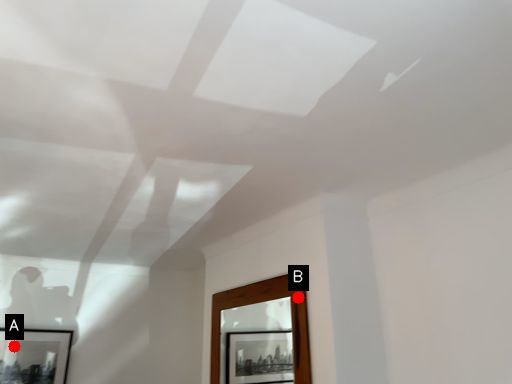
Question: Two points are circled on the image, labeled by A and B beside each circle. Which of the following is the closest to the observer?

Choices:
 (A) A is closer
 (B) B is closer

Answer: (B)